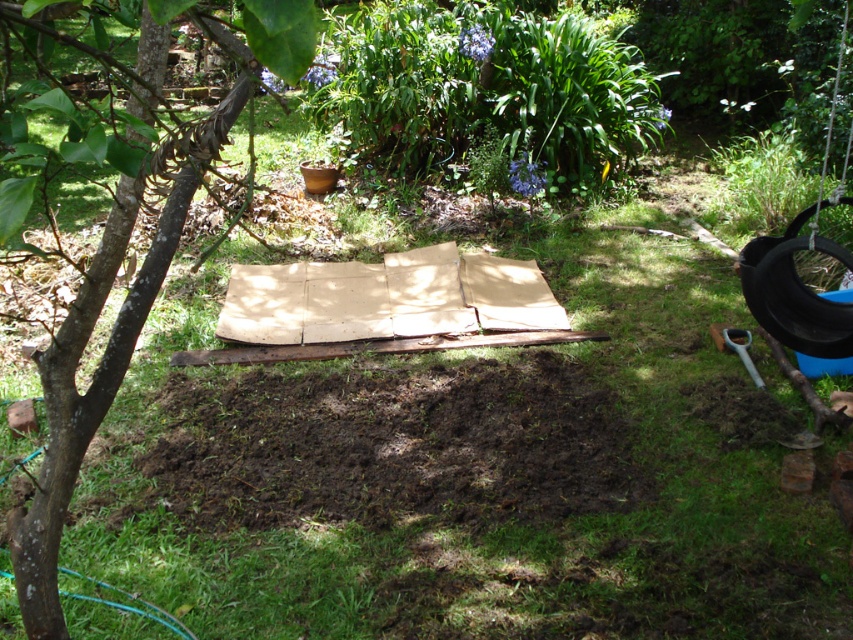
Is brown rough tree at left further to the viewer compared to black rubber tire at right?

That is False.

Between point (70, 420) and point (761, 289), which one is positioned behind?

The point (761, 289) is behind.

Does point (39, 545) lie behind point (776, 330)?

No.

Image resolution: width=853 pixels, height=640 pixels. I want to click on brown rough tree at left, so click(x=106, y=344).